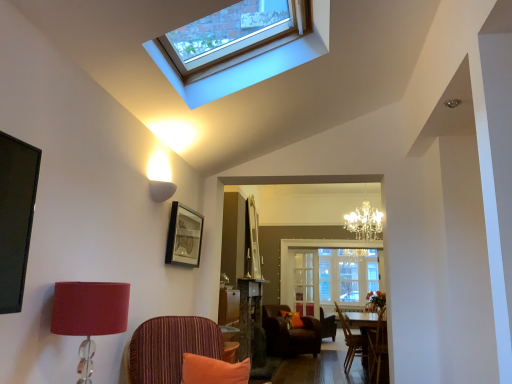
Image resolution: width=512 pixels, height=384 pixels. In order to click on velvet brown armchair at center in this screenshot , I will do `click(327, 325)`.

Describe the element at coordinates (169, 348) in the screenshot. The height and width of the screenshot is (384, 512). I see `striped fabric chair at center, the first chair from the front` at that location.

This screenshot has height=384, width=512. Identify the location of brown leather armchair at center, which is counted as the fourth chair, starting from the front. (290, 334).

Locate an element on the screen. This screenshot has height=384, width=512. wooden chair at right, which is counted as the 2th chair, starting from the front is located at coordinates (377, 345).

Describe the element at coordinates (377, 345) in the screenshot. I see `wooden chair at right, which is counted as the 2th chair, starting from the front` at that location.

Locate an element on the screen. Image resolution: width=512 pixels, height=384 pixels. clear glass window at upper center is located at coordinates (251, 63).

At what (x,y) coordinates should I click in order to perform the action: click on orange fabric pillow at center, which ranks as the 1th pillow in right-to-left order. Please return your answer as a coordinate pair (x, y). Image resolution: width=512 pixels, height=384 pixels. Looking at the image, I should click on (292, 319).

In terms of height, does brown leather armchair at center, the 1th chair viewed from the back, look taller or shorter compared to velvet brown armchair at center?

In the image, brown leather armchair at center, the 1th chair viewed from the back, appears to be taller than velvet brown armchair at center.

Considering the positions of objects brown leather armchair at center, which is counted as the fourth chair, starting from the front, and velvet brown armchair at center in the image provided, who is in front, brown leather armchair at center, which is counted as the fourth chair, starting from the front, or velvet brown armchair at center?

brown leather armchair at center, which is counted as the fourth chair, starting from the front, is more forward.

Does point (267, 346) come in front of point (321, 308)?

Yes, it is in front of point (321, 308).

This screenshot has height=384, width=512. What are the coordinates of `picture frame on the left side of orange fabric pillow at lower center, the first pillow from the top` in the screenshot? It's located at (184, 236).

From a real-world perspective, is orange fabric pillow at lower center, placed as the first pillow when sorted from front to back, on top of matte black picture frame at upper center?

No, from a real-world perspective, orange fabric pillow at lower center, placed as the first pillow when sorted from front to back, is not over matte black picture frame at upper center

Between orange fabric pillow at lower center, placed as the first pillow when sorted from front to back, and matte black picture frame at upper center, which one has larger size?

With larger size is matte black picture frame at upper center.

How different are the orientations of clear glass cabinet at center and white glass window screen at center in degrees?

clear glass cabinet at center and white glass window screen at center are facing 0.369 degrees away from each other.

Does point (307, 277) appear closer or farther from the camera than point (301, 250)?

Point (307, 277) is positioned closer to the camera compared to point (301, 250).

Considering the sizes of clear glass cabinet at center and white glass window screen at center in the image, is clear glass cabinet at center bigger or smaller than white glass window screen at center?

In the image, clear glass cabinet at center appears to be smaller than white glass window screen at center.

Is white glass window screen at center at the back of clear glass cabinet at center?

Correct, clear glass cabinet at center is looking away from white glass window screen at center.

From a real-world perspective, is velvet brown armchair at center located beneath orange fabric pillow at lower center, placed as the first pillow when sorted from front to back?

Yes, from a real-world perspective, velvet brown armchair at center is beneath orange fabric pillow at lower center, placed as the first pillow when sorted from front to back.

Can you confirm if velvet brown armchair at center is thinner than orange fabric pillow at lower center, the first pillow from the top?

No, velvet brown armchair at center is not thinner than orange fabric pillow at lower center, the first pillow from the top.

Is velvet brown armchair at center not within orange fabric pillow at lower center, which ranks as the 2th pillow in right-to-left order?

Yes, velvet brown armchair at center is not within orange fabric pillow at lower center, which ranks as the 2th pillow in right-to-left order.

Is velvet brown armchair at center smaller than orange fabric pillow at lower center, placed as the first pillow when sorted from front to back?

A: No, velvet brown armchair at center is not smaller than orange fabric pillow at lower center, placed as the first pillow when sorted from front to back.

Is matte black picture frame at upper center located within matte red lampshade at left?

No.

Image resolution: width=512 pixels, height=384 pixels. Identify the location of picture frame to the right of matte red lampshade at left. (184, 236).

Between matte red lampshade at left and matte black picture frame at upper center, which one appears on the right side from the viewer's perspective?

From the viewer's perspective, matte black picture frame at upper center appears more on the right side.

Does point (245, 375) lie in front of point (310, 248)?

Yes, it is in front of point (310, 248).

Is orange fabric pillow at lower center, the first pillow from the top, bigger than white glass window screen at center?

No, orange fabric pillow at lower center, the first pillow from the top, is not bigger than white glass window screen at center.

Which object is wider, orange fabric pillow at lower center, the first pillow from the top, or white glass window screen at center?

white glass window screen at center is wider.

Looking at this image, between orange fabric pillow at lower center, which ranks as the 2th pillow in right-to-left order, and white glass window screen at center, which one appears on the right side from the viewer's perspective?

Positioned to the right is white glass window screen at center.

Is matte black picture frame at upper center in contact with wooden chair at right, which is counted as the 2th chair, starting from the front?

No, matte black picture frame at upper center is not beside wooden chair at right, which is counted as the 2th chair, starting from the front.

Between matte black picture frame at upper center and wooden chair at right, acting as the third chair starting from the back, which one has larger size?

wooden chair at right, acting as the third chair starting from the back, is bigger.

Can you tell me how much matte black picture frame at upper center and wooden chair at right, which is counted as the 2th chair, starting from the front, differ in facing direction?

The angle between the facing direction of matte black picture frame at upper center and the facing direction of wooden chair at right, which is counted as the 2th chair, starting from the front, is 89.6 degrees.

From a real-world perspective, which is physically above, matte black picture frame at upper center or wooden chair at right, acting as the third chair starting from the back?

In real-world perspective, matte black picture frame at upper center is above.

Identify the location of chair that is the 1st one when counting leftward from the velvet brown armchair at center. The height and width of the screenshot is (384, 512). (290, 334).

You are a GUI agent. You are given a task and a screenshot of the screen. Output one action in this format:
    pyautogui.click(x=<x>, y=<y>)
    Task: Click on the picture frame above the orange fabric pillow at lower center, placed as the 1th pillow when sorted from left to right (from the image's perspective)
    
    Given the screenshot: What is the action you would take?
    pyautogui.click(x=184, y=236)

When comparing their distances from velvet brown armchair at center, does white glass window screen at center or wooden chair at right, which is counted as the 2th chair, starting from the front, seem closer?

white glass window screen at center lies closer to velvet brown armchair at center than the other object.

From the picture: Considering their positions, is striped fabric chair at center, which is counted as the 4th chair, starting from the back, positioned closer to orange fabric pillow at center, which is counted as the 2th pillow, starting from the front, than clear glass cabinet at center?

clear glass cabinet at center lies closer to orange fabric pillow at center, which is counted as the 2th pillow, starting from the front, than the other object.

Looking at the image, which one is located further to brown leather armchair at center, which is counted as the fourth chair, starting from the front, wooden chair at right, which is counted as the 2th chair, starting from the front, or orange fabric pillow at lower center, the first pillow from the top?

orange fabric pillow at lower center, the first pillow from the top, is further to brown leather armchair at center, which is counted as the fourth chair, starting from the front.

Estimate the real-world distances between objects in this image. Which object is further from velvet brown armchair at center, brown leather armchair at center, the 1th chair viewed from the back, or clear glass cabinet at center?

clear glass cabinet at center.

From the image, which object appears to be farther from clear glass window at upper center, velvet brown armchair at center or orange fabric pillow at lower center, placed as the first pillow when sorted from front to back?

velvet brown armchair at center.

From the image, which object appears to be farther from wooden chair at lower right, which is the third chair from front to back, clear glass window at upper center or brown leather armchair at center, the 1th chair viewed from the back?

The object further to wooden chair at lower right, which is the third chair from front to back, is clear glass window at upper center.

Which object lies nearer to the anchor point wooden chair at right, which is counted as the 2th chair, starting from the front, white glass window screen at center or orange fabric pillow at center, which ranks as the 1th pillow in right-to-left order?

orange fabric pillow at center, which ranks as the 1th pillow in right-to-left order, is closer to wooden chair at right, which is counted as the 2th chair, starting from the front.

Considering their positions, is matte black picture frame at upper center positioned closer to matte red lampshade at left than orange fabric pillow at center, which ranks as the 1th pillow in right-to-left order?

Based on the image, matte black picture frame at upper center appears to be nearer to matte red lampshade at left.

Locate an element on the screen. picture frame located between matte red lampshade at left and clear glass cabinet at center in the depth direction is located at coordinates (184, 236).

I want to click on glass door positioned between orange fabric pillow at lower center, the 2th pillow ordered from the bottom, and velvet brown armchair at center from near to far, so click(x=305, y=282).

This screenshot has height=384, width=512. Identify the location of window screen between wooden chair at lower right, which is the third chair from front to back, and velvet brown armchair at center from front to back. (329, 273).

Identify the location of chair between matte red lampshade at left and wooden chair at right, acting as the third chair starting from the back, from front to back. (169, 348).